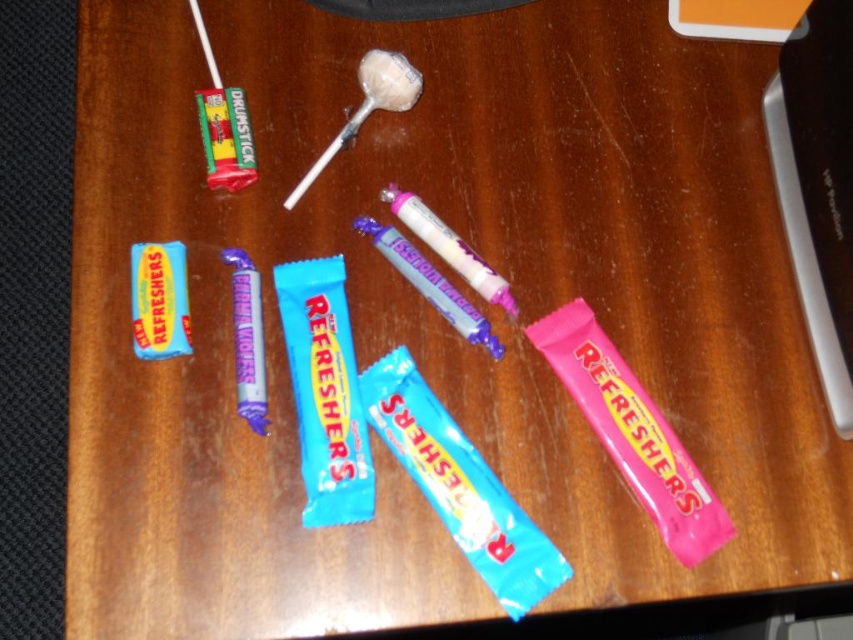
Question: Is blue wrapper candy bar at center above pink glossy lollipop at center?

Choices:
 (A) yes
 (B) no

Answer: (B)

Question: Which point is farther from the camera taking this photo?

Choices:
 (A) (438, 410)
 (B) (320, 422)
 (C) (494, 346)

Answer: (C)

Question: Considering the real-world distances, which object is closest to the purple shiny candy bar at center?

Choices:
 (A) blue wrapper candy bar at center
 (B) pink matte refreshers bar at center

Answer: (A)

Question: Which of the following is the farthest from the observer?

Choices:
 (A) pink matte refreshers bar at center
 (B) blue shiny wrapper at center

Answer: (A)

Question: Does pink matte refreshers bar at center come in front of pink glossy lollipop at center?

Choices:
 (A) yes
 (B) no

Answer: (A)

Question: Is blue matte refreshers bar at center smaller than purple shiny candy bar at center?

Choices:
 (A) no
 (B) yes

Answer: (B)